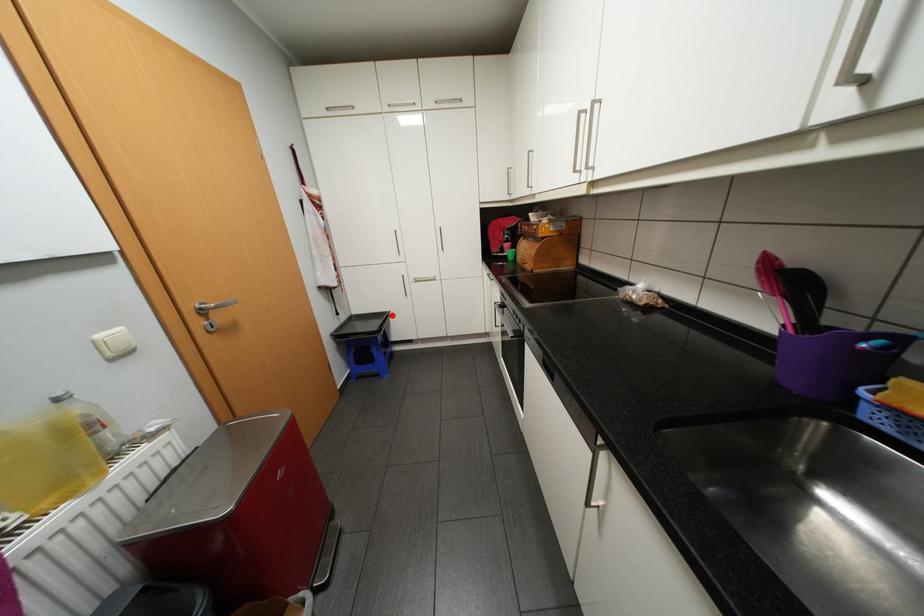
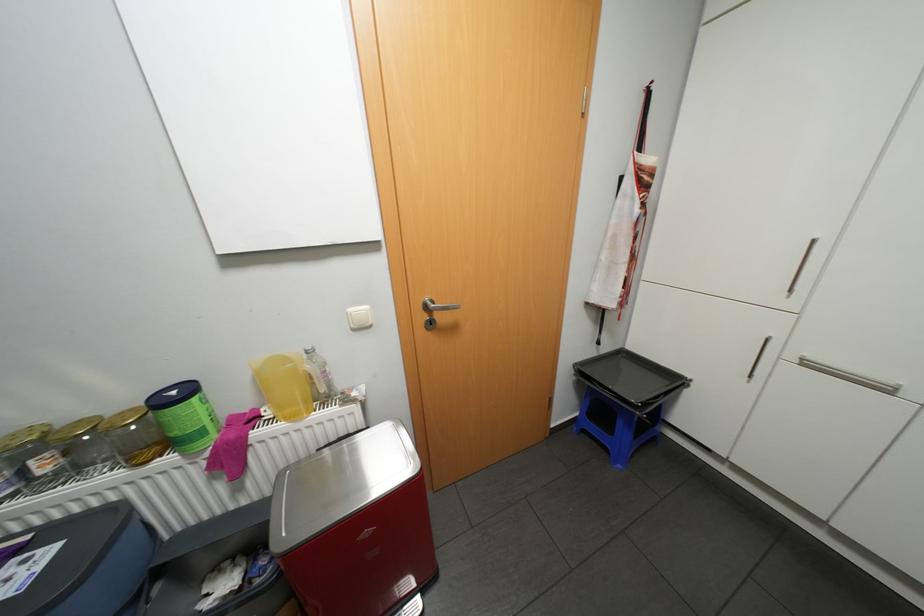
The point at the highlighted location is marked in the first image. Where is the corresponding point in the second image?

(684, 379)